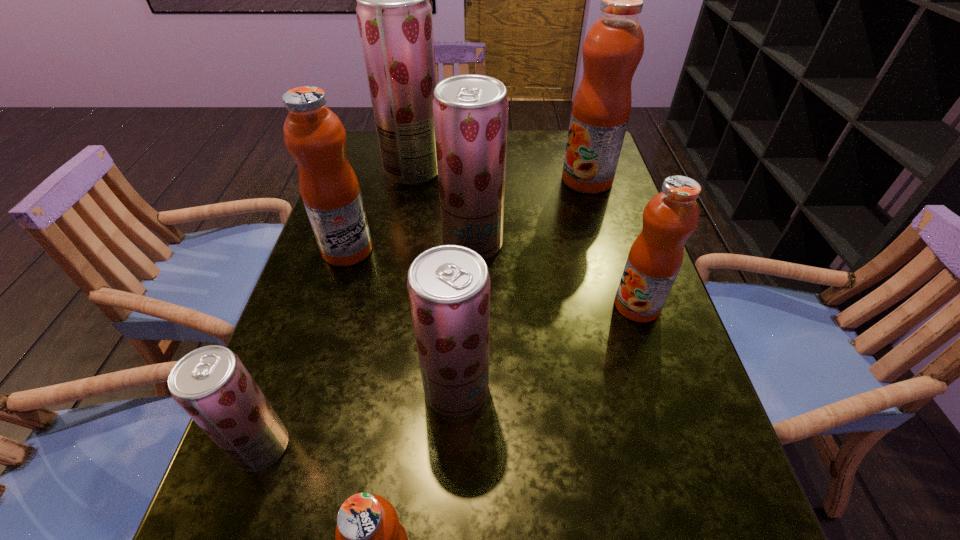
Where is `the second strawberry fruit juice from left to right`? Image resolution: width=960 pixels, height=540 pixels. the second strawberry fruit juice from left to right is located at coordinates (394, 15).

In order to click on the biggest strawberry fruit juice in this screenshot , I will do `click(394, 15)`.

I want to click on the farthest orange fruit juice, so point(614,45).

Locate an element on the screen. This screenshot has height=540, width=960. the second farthest strawberry fruit juice is located at coordinates (470, 111).

You are a GUI agent. You are given a task and a screenshot of the screen. Output one action in this format:
    pyautogui.click(x=<x>, y=<y>)
    Task: Click on the third smallest orange fruit juice
    The width and height of the screenshot is (960, 540).
    Given the screenshot: What is the action you would take?
    pyautogui.click(x=313, y=134)

I want to click on the third nearest orange fruit juice, so click(x=313, y=134).

Locate an element on the screen. The height and width of the screenshot is (540, 960). the second smallest strawberry fruit juice is located at coordinates (x=448, y=286).

At what (x,y) coordinates should I click in order to perform the action: click on the third farthest strawberry fruit juice. Please return your answer as a coordinate pair (x, y). The image size is (960, 540). Looking at the image, I should click on (448, 286).

Identify the location of the fourth nearest fruit juice. The width and height of the screenshot is (960, 540). (670, 217).

At what (x,y) coordinates should I click in order to perform the action: click on the fourth nearest object. Please return your answer as a coordinate pair (x, y). The image size is (960, 540). Looking at the image, I should click on (670, 217).